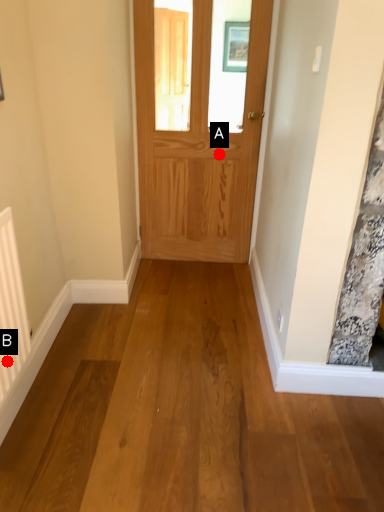
Question: Two points are circled on the image, labeled by A and B beside each circle. Which of the following is the closest to the observer?

Choices:
 (A) A is closer
 (B) B is closer

Answer: (B)